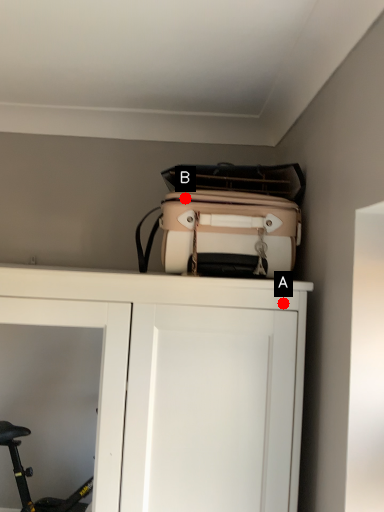
Question: Two points are circled on the image, labeled by A and B beside each circle. Among these points, which one is nearest to the camera?

Choices:
 (A) A is closer
 (B) B is closer

Answer: (A)